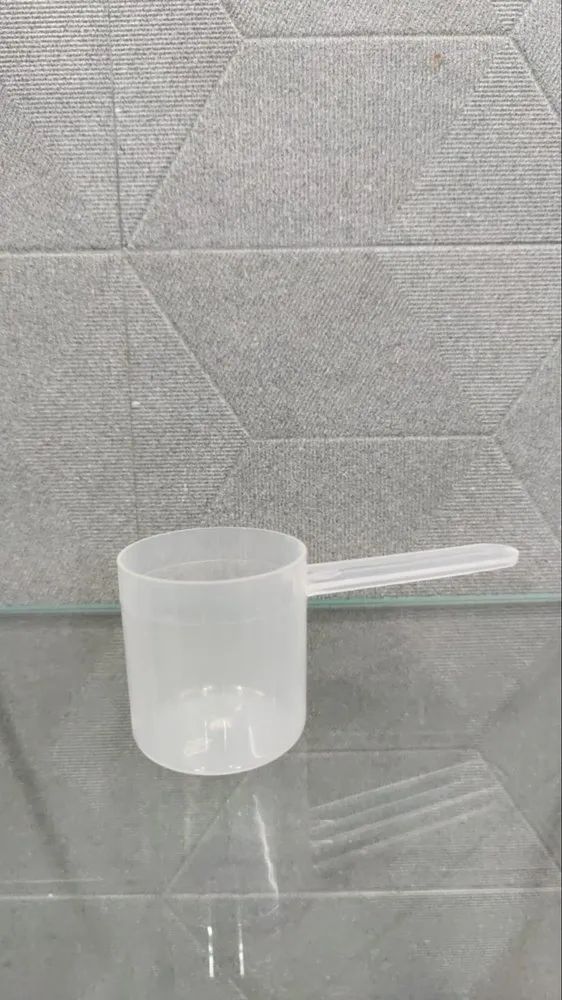
This screenshot has height=1000, width=562. I want to click on tile grout lines, so click(x=411, y=893), click(x=212, y=820), click(x=406, y=750), click(x=522, y=816), click(x=95, y=895), click(x=203, y=946).